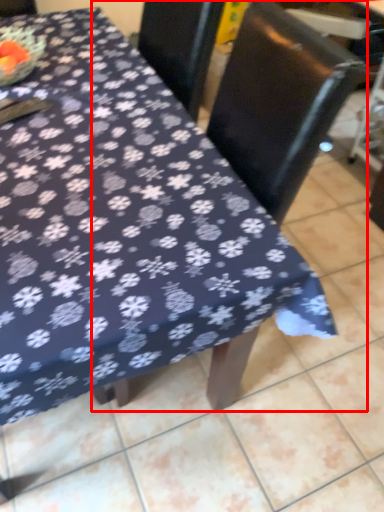
Question: From the image's perspective, what is the correct spatial positioning of chair (annotated by the red box) in reference to swivel chair?

Choices:
 (A) above
 (B) below

Answer: (B)